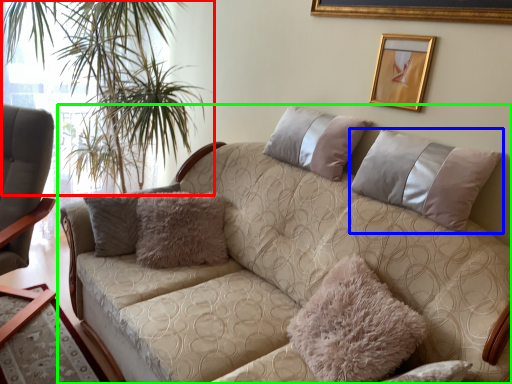
Question: Considering the real-world distances, which object is farthest from plant (highlighted by a red box)? pillow (highlighted by a blue box) or studio couch (highlighted by a green box)?

Choices:
 (A) pillow
 (B) studio couch

Answer: (A)